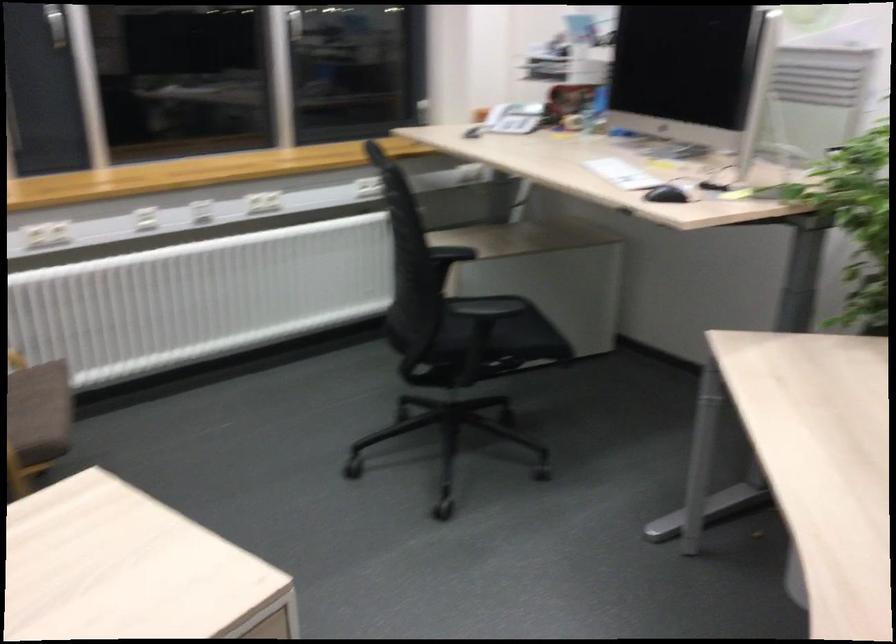
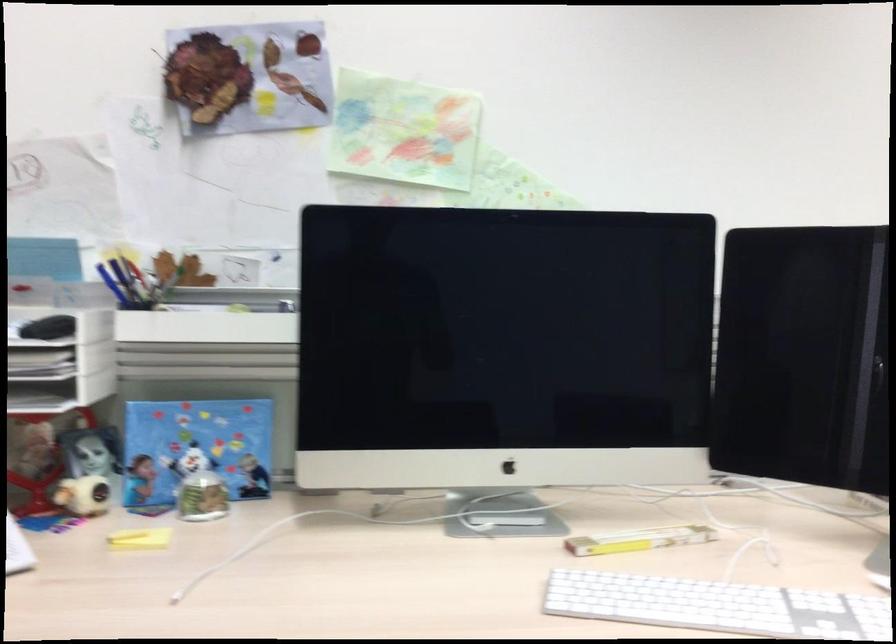
Find the pixel in the second image that matches (684,162) in the first image.

(638, 540)